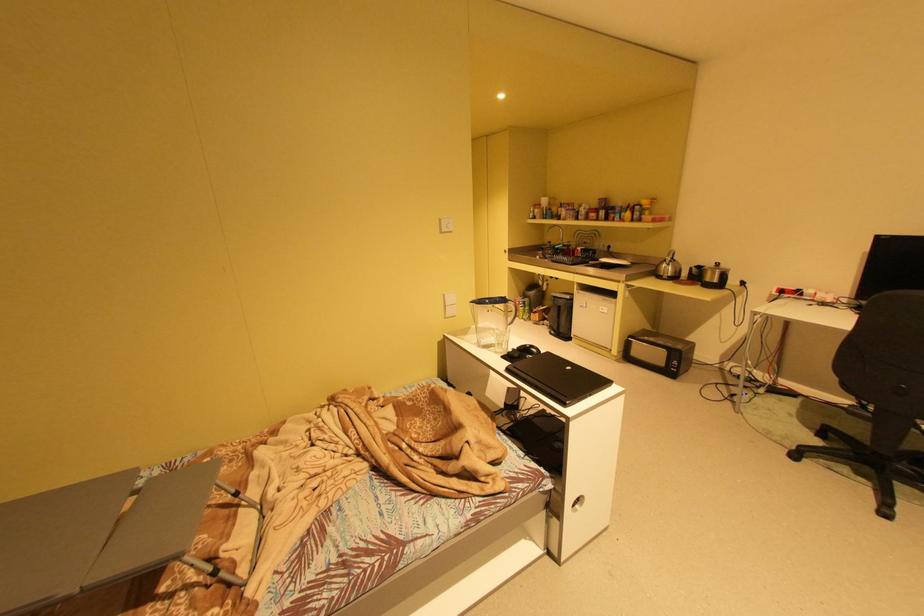
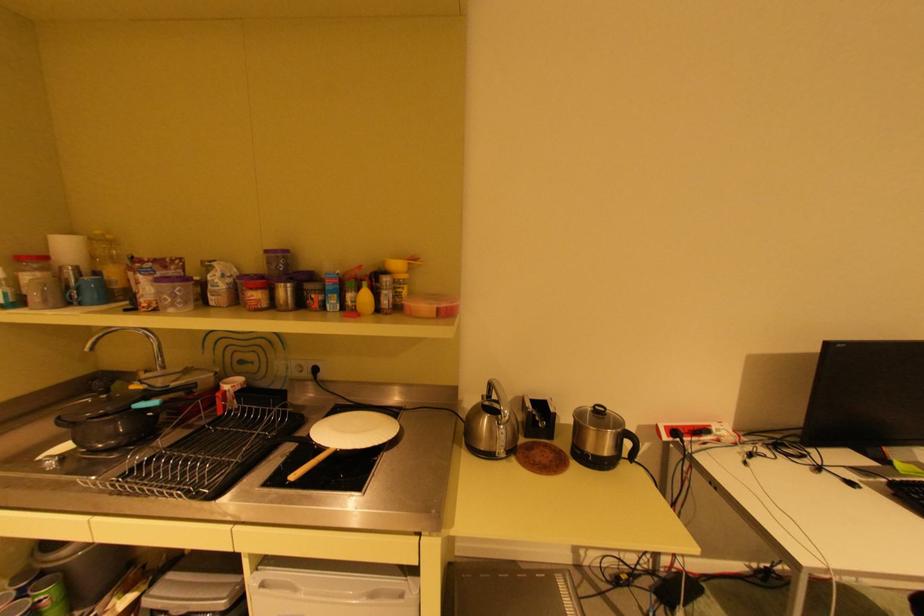
In the second image, find the point that corresponds to (563,294) in the first image.

(168, 609)